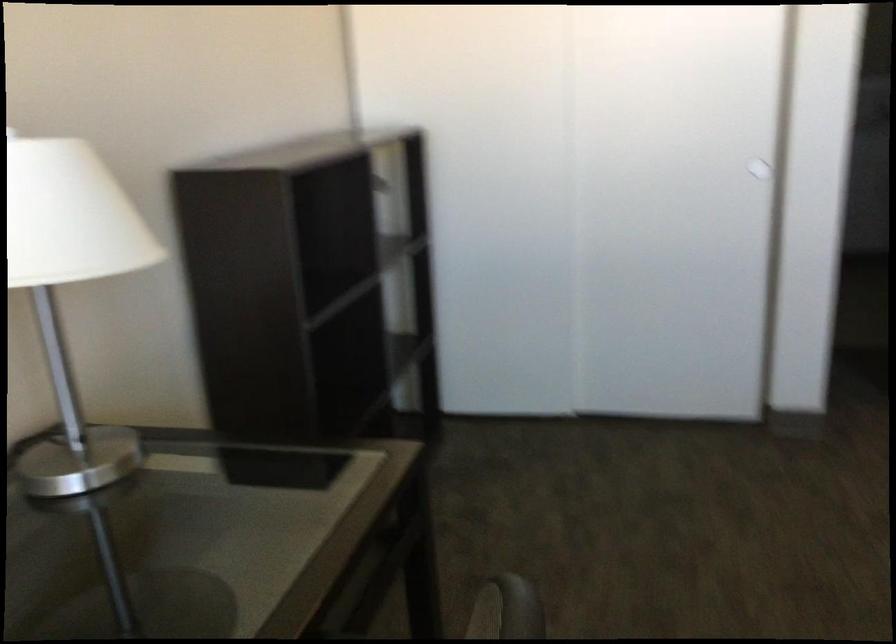
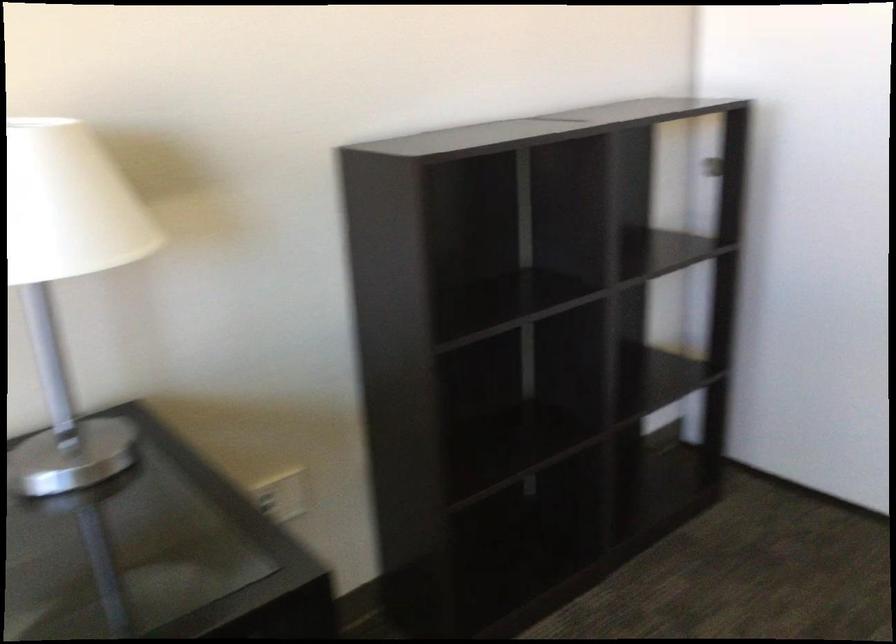
Question: The camera is either moving clockwise (left) or counter-clockwise (right) around the object. The first image is from the beginning of the video and the second image is from the end. Is the camera moving left or right when shooting the video?

Choices:
 (A) Left
 (B) Right

Answer: (B)